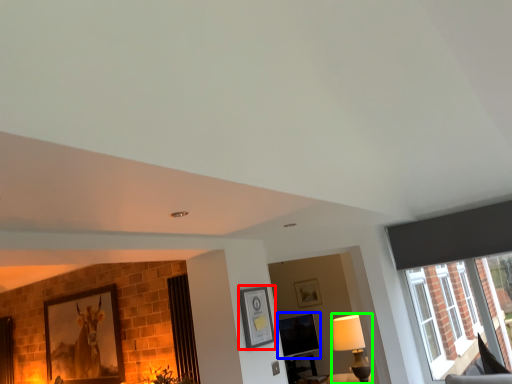
Question: Considering the real-world distances, which object is closest to picture frame (highlighted by a red box)? window screen (highlighted by a blue box) or lamp (highlighted by a green box).

Choices:
 (A) window screen
 (B) lamp

Answer: (B)